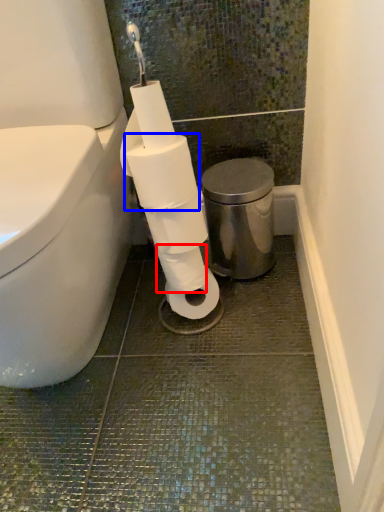
Question: Which object appears closest to the camera in this image, toilet paper (highlighted by a red box) or toilet paper (highlighted by a blue box)?

Choices:
 (A) toilet paper
 (B) toilet paper

Answer: (B)